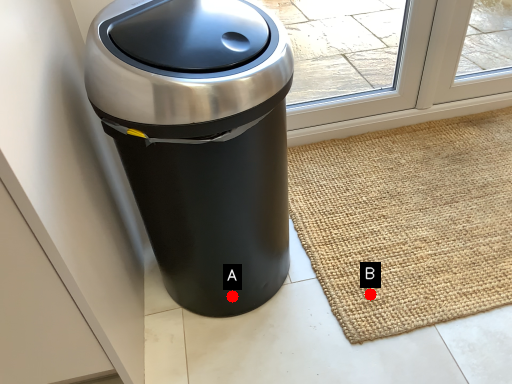
Question: Two points are circled on the image, labeled by A and B beside each circle. Which of the following is the closest to the observer?

Choices:
 (A) A is closer
 (B) B is closer

Answer: (A)